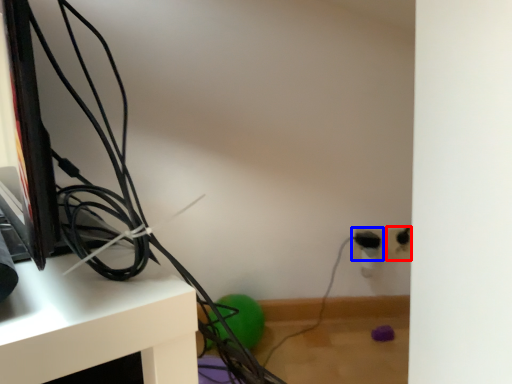
Question: Which of the following is the farthest to the observer, electric outlet (highlighted by a red box) or electric outlet (highlighted by a blue box)?

Choices:
 (A) electric outlet
 (B) electric outlet

Answer: (A)